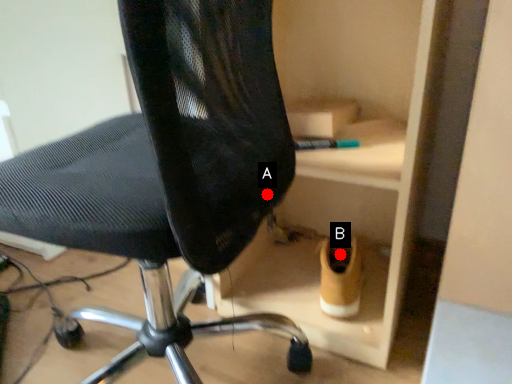
Question: Two points are circled on the image, labeled by A and B beside each circle. Among these points, which one is nearest to the camera?

Choices:
 (A) A is closer
 (B) B is closer

Answer: (A)